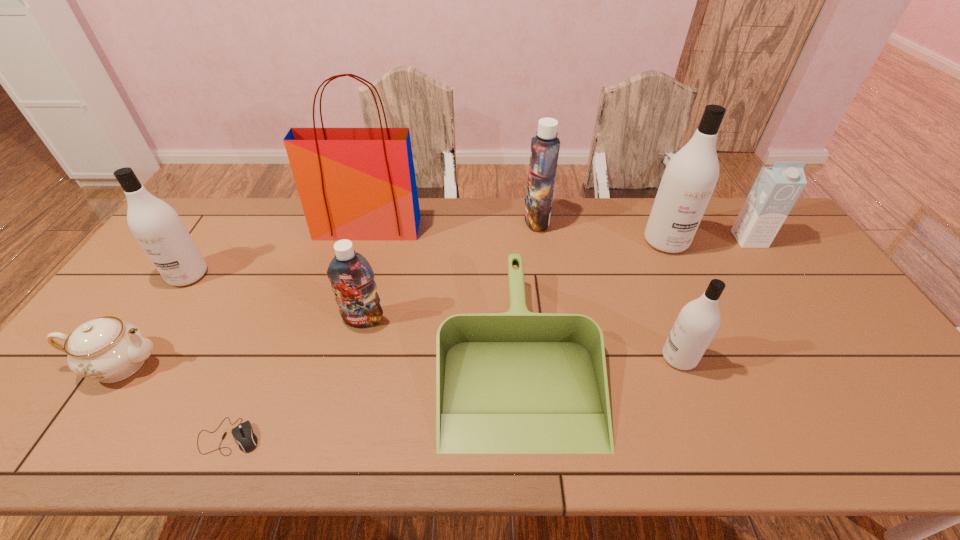
Locate an element on the screen. Image resolution: width=960 pixels, height=540 pixels. shopping bag is located at coordinates (354, 183).

The width and height of the screenshot is (960, 540). In order to click on the farthest white shampoo in this screenshot , I will do click(691, 175).

At what (x,y) coordinates should I click in order to perform the action: click on the second tallest object. Please return your answer as a coordinate pair (x, y). Looking at the image, I should click on (691, 175).

This screenshot has width=960, height=540. In order to click on the farther blue shampoo in this screenshot , I will do `click(544, 153)`.

Where is `the bigger blue shampoo`? the bigger blue shampoo is located at coordinates (544, 153).

Find the location of `the second nearest white shampoo`. the second nearest white shampoo is located at coordinates (156, 226).

Image resolution: width=960 pixels, height=540 pixels. What are the coordinates of `the third nearest shampoo` in the screenshot? It's located at (156, 226).

The image size is (960, 540). What are the coordinates of `the rightmost object` in the screenshot? It's located at (776, 189).

In order to click on the nearest shampoo in this screenshot , I will do `click(698, 321)`.

Image resolution: width=960 pixels, height=540 pixels. What are the coordinates of `the nearest white shampoo` in the screenshot? It's located at (698, 321).